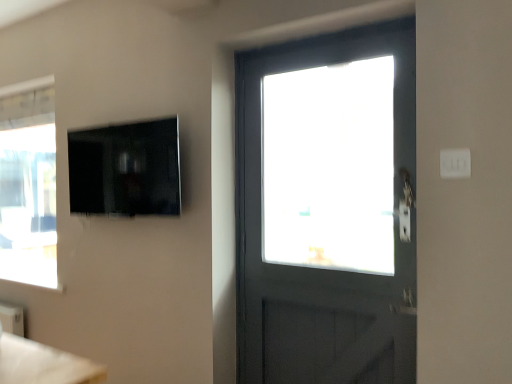
Describe the element at coordinates (125, 169) in the screenshot. This screenshot has height=384, width=512. I see `matte black tv at upper left` at that location.

Identify the location of matte black tv at upper left. Image resolution: width=512 pixels, height=384 pixels. point(125,169).

Locate an element on the screen. The image size is (512, 384). white plastic light switch at upper right is located at coordinates (455, 163).

Describe the element at coordinates (455, 163) in the screenshot. I see `white plastic light switch at upper right` at that location.

Identify the location of matte black tv at upper left. (125, 169).

Visually, is matte black tv at upper left positioned to the left or to the right of white plastic light switch at upper right?

Based on their positions, matte black tv at upper left is located to the left of white plastic light switch at upper right.

In the image, is matte black tv at upper left positioned in front of or behind white plastic light switch at upper right?

matte black tv at upper left is behind white plastic light switch at upper right.

In the scene shown: Which is closer to the camera, (142, 142) or (447, 151)?

The point (447, 151) is closer to the camera.

From the image's perspective, which is above, matte black tv at upper left or white plastic light switch at upper right?

matte black tv at upper left appears higher in the image.

From a real-world perspective, is matte black tv at upper left positioned above or below white plastic light switch at upper right?

In terms of real-world spatial position, matte black tv at upper left is above white plastic light switch at upper right.

Considering the sizes of objects matte black tv at upper left and white plastic light switch at upper right in the image provided, who is thinner, matte black tv at upper left or white plastic light switch at upper right?

white plastic light switch at upper right is thinner.

Who is shorter, matte black tv at upper left or white plastic light switch at upper right?

white plastic light switch at upper right is shorter.

Considering the relative sizes of matte black tv at upper left and white plastic light switch at upper right in the image provided, is matte black tv at upper left bigger than white plastic light switch at upper right?

Yes, matte black tv at upper left is bigger than white plastic light switch at upper right.

Choose the correct answer: Is matte black tv at upper left inside white plastic light switch at upper right or outside it?

matte black tv at upper left lies outside white plastic light switch at upper right.

Is matte black tv at upper left next to white plastic light switch at upper right?

matte black tv at upper left is not next to white plastic light switch at upper right, and they're not touching.

Is matte black tv at upper left looking in the opposite direction of white plastic light switch at upper right?

No, white plastic light switch at upper right is not at the back of matte black tv at upper left.

From the picture: What's the angular difference between matte black tv at upper left and white plastic light switch at upper right's facing directions?

The facing directions of matte black tv at upper left and white plastic light switch at upper right are 2.53 degrees apart.

Identify the location of light switch located on the right of matte black tv at upper left. (455, 163).

Which is more to the right, white plastic light switch at upper right or matte black tv at upper left?

white plastic light switch at upper right.

Considering the positions of objects white plastic light switch at upper right and matte black tv at upper left in the image provided, who is behind, white plastic light switch at upper right or matte black tv at upper left?

matte black tv at upper left is further from the camera.

Is point (449, 161) farther from camera compared to point (144, 211)?

No, it is in front of (144, 211).

From the image's perspective, is white plastic light switch at upper right beneath matte black tv at upper left?

Indeed, from the image's perspective, white plastic light switch at upper right is shown beneath matte black tv at upper left.

From a real-world perspective, is white plastic light switch at upper right positioned over matte black tv at upper left based on gravity?

Actually, white plastic light switch at upper right is physically below matte black tv at upper left in the real world.

Considering the sizes of objects white plastic light switch at upper right and matte black tv at upper left in the image provided, who is thinner, white plastic light switch at upper right or matte black tv at upper left?

white plastic light switch at upper right is thinner.

Can you confirm if white plastic light switch at upper right is taller than matte black tv at upper left?

No, white plastic light switch at upper right is not taller than matte black tv at upper left.

Which of these two, white plastic light switch at upper right or matte black tv at upper left, is smaller?

white plastic light switch at upper right is smaller.

Is white plastic light switch at upper right located outside matte black tv at upper left?

Yes.

Is white plastic light switch at upper right not near matte black tv at upper left?

Yes, white plastic light switch at upper right and matte black tv at upper left are located far from each other.

Is white plastic light switch at upper right looking in the opposite direction of matte black tv at upper left?

No, white plastic light switch at upper right is not facing away from matte black tv at upper left.

What's the angular difference between white plastic light switch at upper right and matte black tv at upper left's facing directions?

2.53 degrees.

Locate an element on the screen. The image size is (512, 384). light switch that is under the matte black tv at upper left (from a real-world perspective) is located at coordinates [455, 163].

Identify the location of window screen on the left of white plastic light switch at upper right. (125, 169).

Locate an element on the screen. light switch that appears below the matte black tv at upper left (from a real-world perspective) is located at coordinates (455, 163).